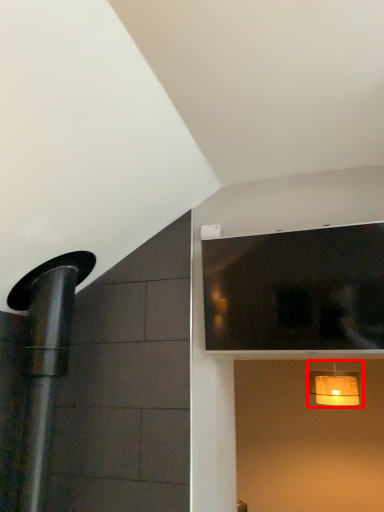
Question: Considering the relative positions of light fixture (annotated by the red box) and window in the image provided, where is light fixture (annotated by the red box) located with respect to the staircase?

Choices:
 (A) right
 (B) left

Answer: (A)